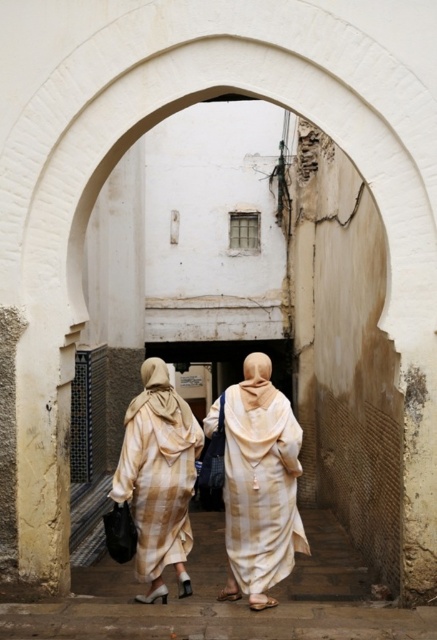
You are a fashion designer observing two garments in the center of a historical archway scene. Which garment is located to the right of the other? The beige cotton dress at center and the beige striped robe at center are both present. Please specify which one is on the right.

The beige cotton dress at center is positioned on the right side of the beige striped robe at center, so the beige cotton dress at center is to the right of the beige striped robe at center.